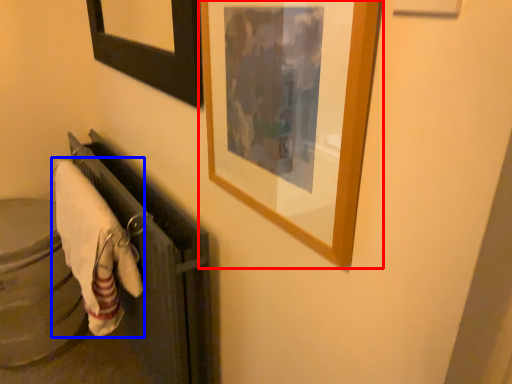
Question: Which object appears closest to the camera in this image, picture frame (highlighted by a red box) or bath towel (highlighted by a blue box)?

Choices:
 (A) picture frame
 (B) bath towel

Answer: (A)